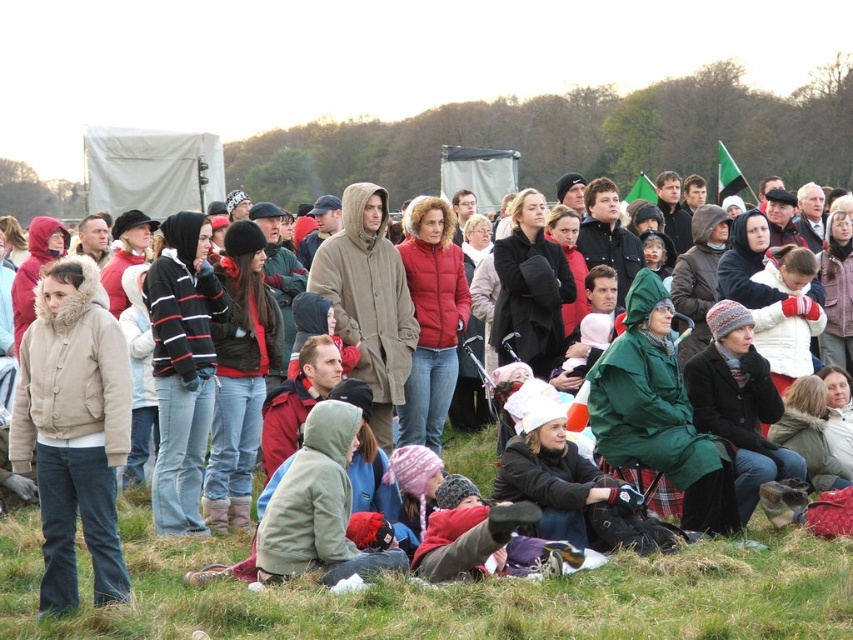
You are a photographer trying to capture a clear shot of the matte green coat at center without the green grass at lower center being in the foreground. Based on their positions, can you position yourself to achieve this?

The matte green coat at center is above green grass at lower center, so positioning yourself at a lower angle or moving to a higher elevation would allow you to frame the coat without the grass in the foreground.